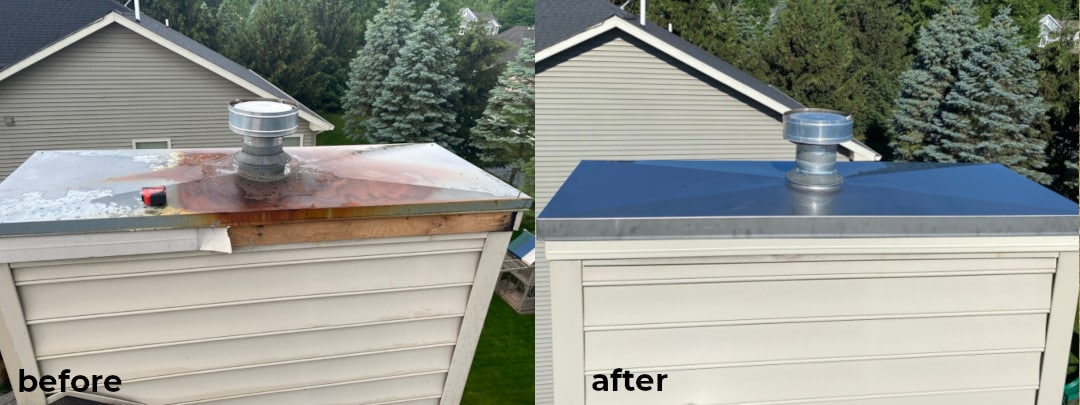
The image size is (1080, 405). What are the coordinates of `windows` in the screenshot? It's located at (166, 140), (297, 139).